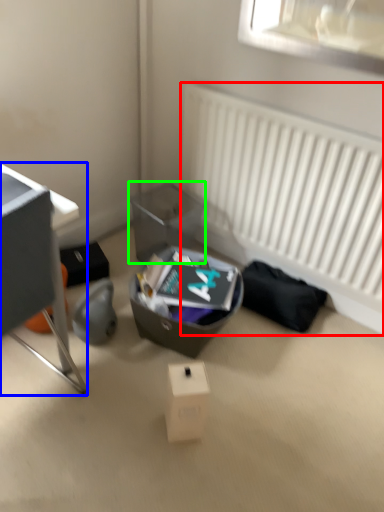
Question: Considering the real-world distances, which object is farthest from radiator (highlighted by a red box)? desk (highlighted by a blue box) or shoe box (highlighted by a green box)?

Choices:
 (A) desk
 (B) shoe box

Answer: (A)